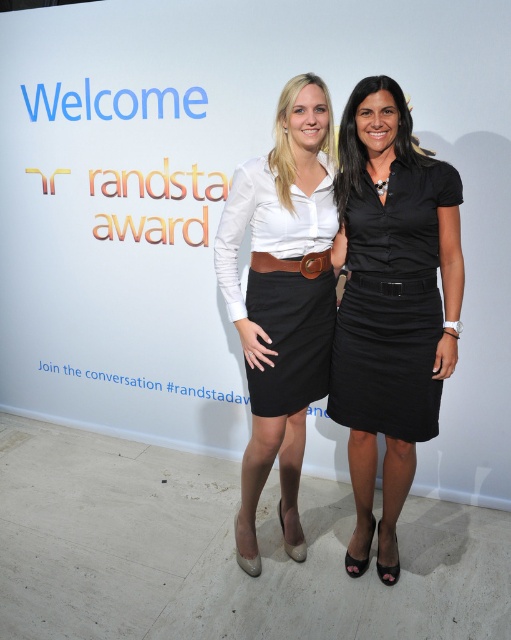
You are a photographer at the event and want to adjust the lighting so that the matte white blouse at center and the brown leather belt at center are equally highlighted. Which object should you move closer to the light source?

The matte white blouse at center is to the left of the brown leather belt at center. To ensure both receive equal lighting, move the matte white blouse at center closer to the light source since it is positioned farther away from the belt, thus requiring more light to achieve balance.